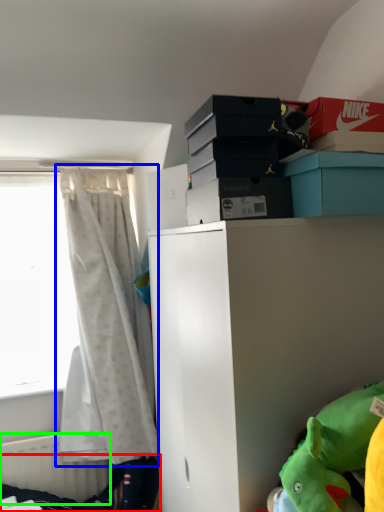
Question: Which is nearer to the bed frame (highlighted by a red box)? curtain (highlighted by a blue box) or radiator (highlighted by a green box).

Choices:
 (A) curtain
 (B) radiator

Answer: (B)